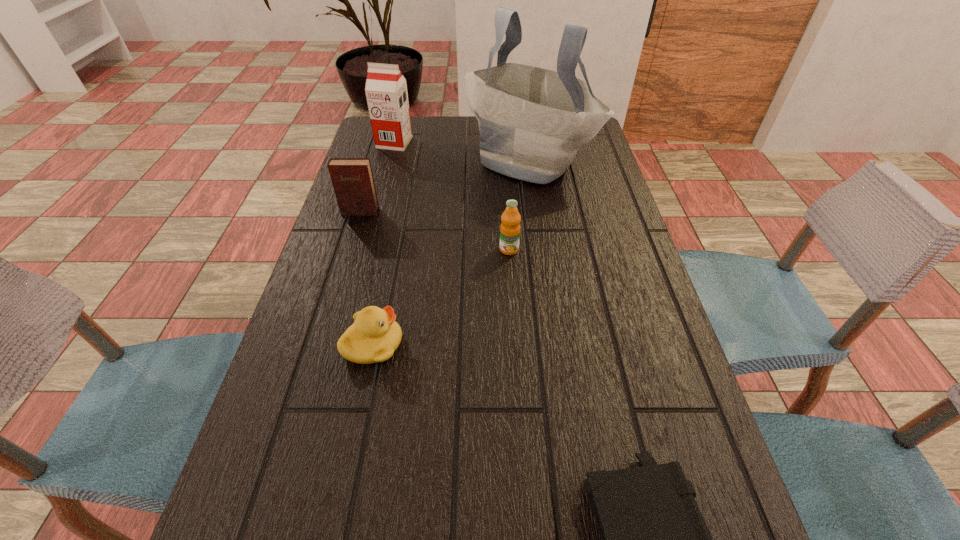
Find the location of a particular element. This screenshot has width=960, height=540. the tallest object is located at coordinates (532, 121).

At what (x,y) coordinates should I click in order to perform the action: click on the second tallest object. Please return your answer as a coordinate pair (x, y). The image size is (960, 540). Looking at the image, I should click on (386, 92).

Locate an element on the screen. The image size is (960, 540). the fourth nearest object is located at coordinates (352, 178).

Locate an element on the screen. orange juice is located at coordinates (510, 227).

The height and width of the screenshot is (540, 960). Find the location of `duckling`. duckling is located at coordinates (375, 335).

Where is `the fifth farthest object`? Image resolution: width=960 pixels, height=540 pixels. the fifth farthest object is located at coordinates (375, 335).

I want to click on vacant area situated on the back of the tallest object, so click(x=522, y=117).

At what (x,y) coordinates should I click in order to perform the action: click on free space located on the front of the soya milk. Please return your answer as a coordinate pair (x, y). This screenshot has height=540, width=960. Looking at the image, I should click on (385, 177).

I want to click on free region located 0.170m on the front cover of the diary, so click(345, 262).

This screenshot has height=540, width=960. Find the location of `vacant region located on the label of the orange juice`. vacant region located on the label of the orange juice is located at coordinates (511, 278).